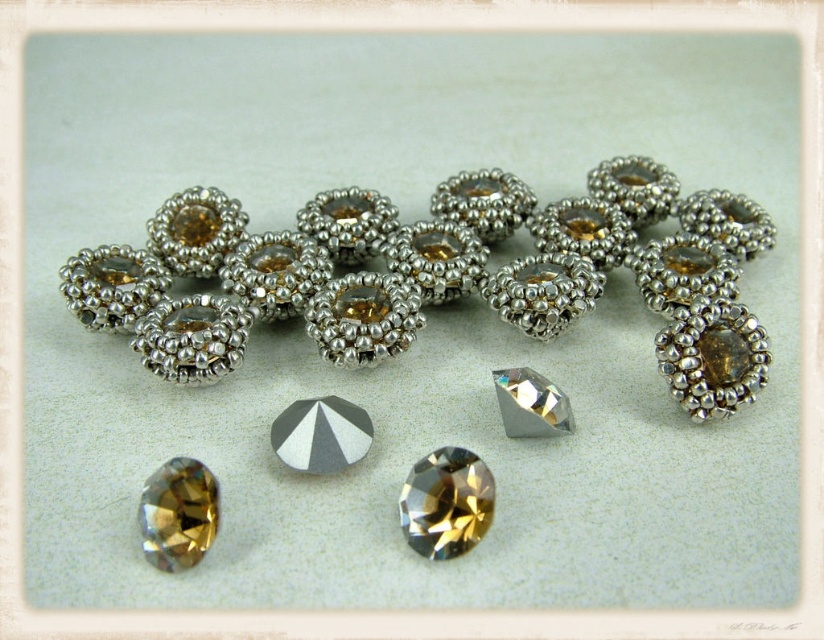
Find the location of a particular element. metallic silver diamond at center is located at coordinates (321, 435).

Is metallic silver diamond at center positioned behind clear crystal diamond at center?

No, it is not.

Is point (283, 449) less distant than point (532, 433)?

That is True.

The width and height of the screenshot is (824, 640). In order to click on metallic silver diamond at center in this screenshot , I will do `click(321, 435)`.

Does matte gold diamond at center have a smaller size compared to faceted gold diamond at center?

No.

Is point (481, 461) positioned in front of point (148, 492)?

No, (481, 461) is behind (148, 492).

This screenshot has height=640, width=824. What are the coordinates of `matte gold diamond at center` in the screenshot? It's located at (446, 502).

Between faceted gold diamond at center and clear crystal diamond at center, which one has more height?

Standing taller between the two is faceted gold diamond at center.

Is faceted gold diamond at center closer to the viewer compared to clear crystal diamond at center?

Yes, faceted gold diamond at center is closer to the viewer.

Is point (139, 493) behind point (517, 392)?

No, (139, 493) is closer to viewer.

What are the coordinates of `faceted gold diamond at center` in the screenshot? It's located at (178, 513).